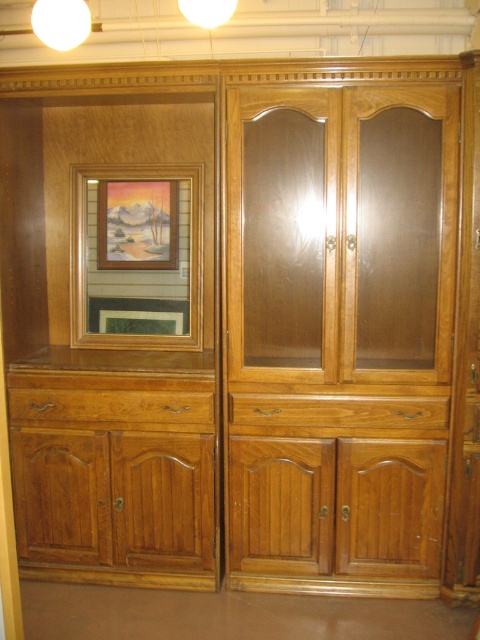
Which of these two, transparent wood cabinet doors at center or matte wooden picture frame at upper left, stands taller?

Standing taller between the two is transparent wood cabinet doors at center.

Find the location of a particular element. The height and width of the screenshot is (640, 480). transparent wood cabinet doors at center is located at coordinates (338, 218).

Consider the image. Is transparent wood cabinet doors at center wider than light brown wood drawer at lower left?

Yes, transparent wood cabinet doors at center is wider than light brown wood drawer at lower left.

Which of these two, transparent wood cabinet doors at center or light brown wood drawer at lower left, stands taller?

With more height is transparent wood cabinet doors at center.

Which is behind, point (443, 236) or point (196, 413)?

The point (196, 413) is behind.

Identify the location of transparent wood cabinet doors at center. (338, 218).

Who is positioned more to the left, light brown wood armoire at center or matte wooden picture frame at upper left?

matte wooden picture frame at upper left is more to the left.

Image resolution: width=480 pixels, height=640 pixels. Identify the location of light brown wood armoire at center. (352, 330).

Between point (322, 424) and point (115, 250), which one is positioned behind?

Point (115, 250)

I want to click on light brown wood armoire at center, so click(x=352, y=330).